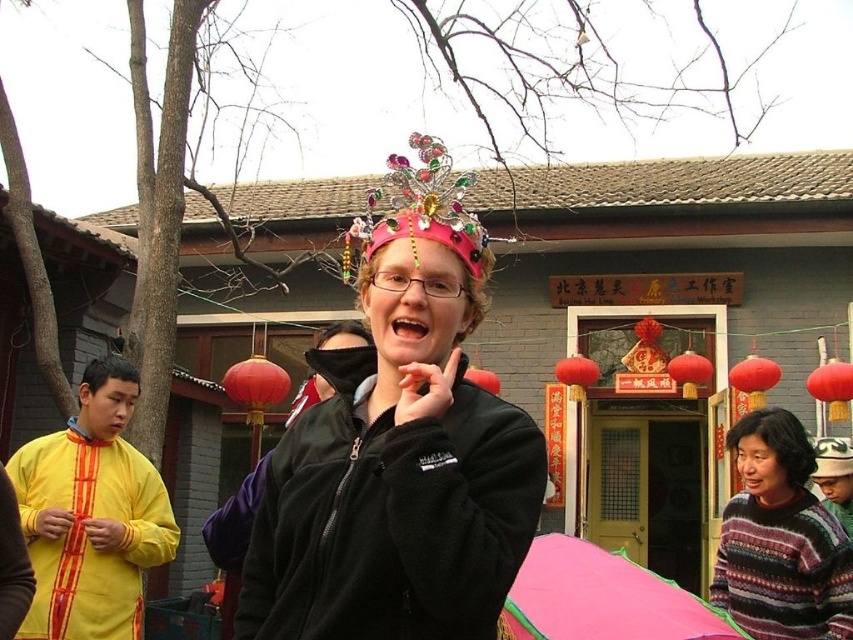
Question: Does yellow fabric head at left appear under red matte paper lantern at center?

Choices:
 (A) yes
 (B) no

Answer: (B)

Question: Which point is closer to the camera?

Choices:
 (A) matte black sweater at lower right
 (B) red matte paper lantern at center
 (C) black fabric mask at center

Answer: (C)

Question: Does yellow cotton shirt at left come in front of black fabric mask at center?

Choices:
 (A) yes
 (B) no

Answer: (B)

Question: Can you confirm if yellow cotton shirt at left is wider than matte black sweater at lower right?

Choices:
 (A) yes
 (B) no

Answer: (B)

Question: Which of these objects is positioned farthest from the red matte paper lantern at center?

Choices:
 (A) multicolored knitted sweater at center
 (B) matte black sweater at lower right

Answer: (A)

Question: Which of the following is the closest to the observer?

Choices:
 (A) (430, 220)
 (B) (805, 579)
 (C) (323, 340)

Answer: (A)